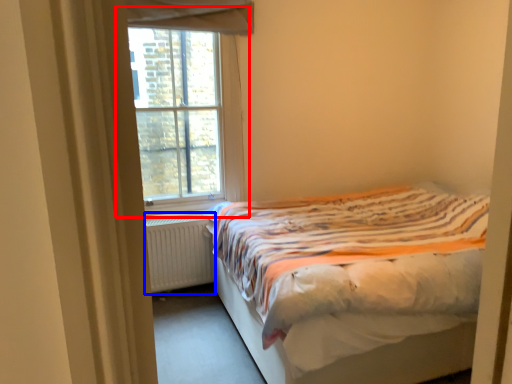
Question: Which object is closer to the camera taking this photo, window (highlighted by a red box) or radiator (highlighted by a blue box)?

Choices:
 (A) window
 (B) radiator

Answer: (A)